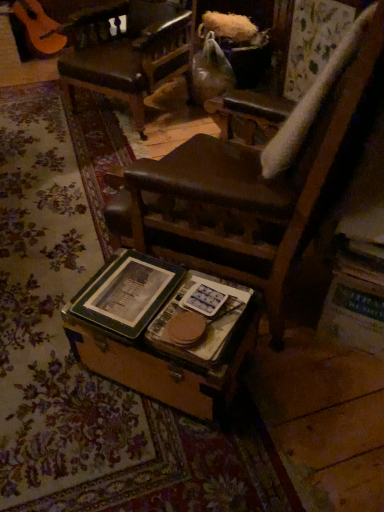
Locate an element on the screen. Image resolution: width=384 pixels, height=512 pixels. free spot above green matte book at center, arranged as the 2th paperback book when viewed from the right (from a real-world perspective) is located at coordinates (132, 285).